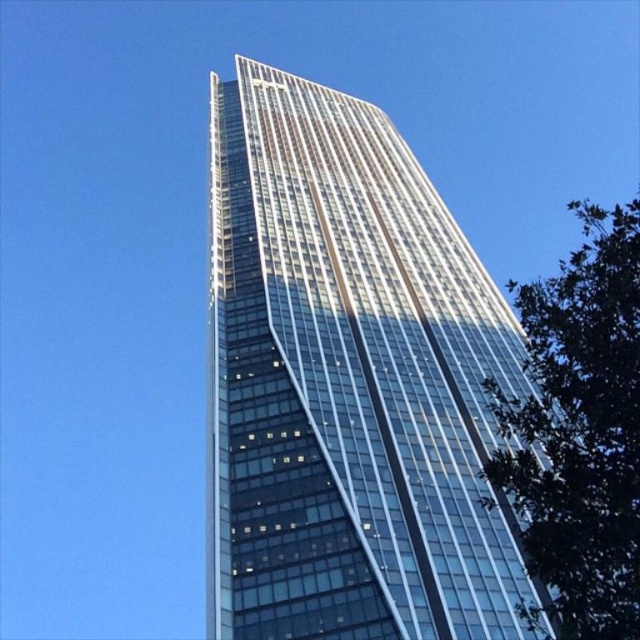
Question: Does transparent glass tower at center come in front of green leafy tree at right?

Choices:
 (A) yes
 (B) no

Answer: (B)

Question: Which object is farther from the camera taking this photo?

Choices:
 (A) transparent glass tower at center
 (B) green leafy tree at right

Answer: (A)

Question: Among these objects, which one is nearest to the camera?

Choices:
 (A) transparent glass tower at center
 (B) green leafy tree at right

Answer: (B)

Question: Is transparent glass tower at center to the left of green leafy tree at right from the viewer's perspective?

Choices:
 (A) no
 (B) yes

Answer: (B)

Question: Is transparent glass tower at center behind green leafy tree at right?

Choices:
 (A) no
 (B) yes

Answer: (B)